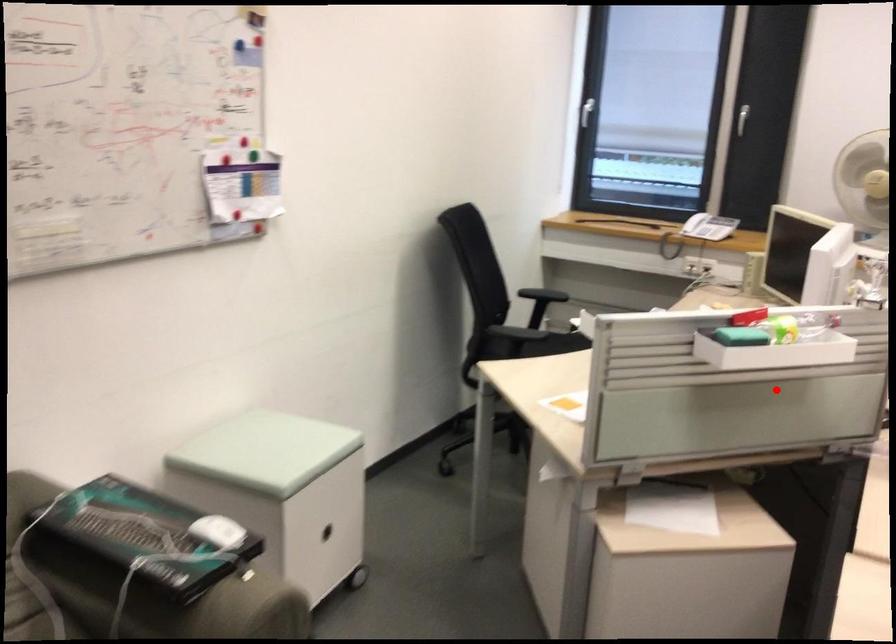
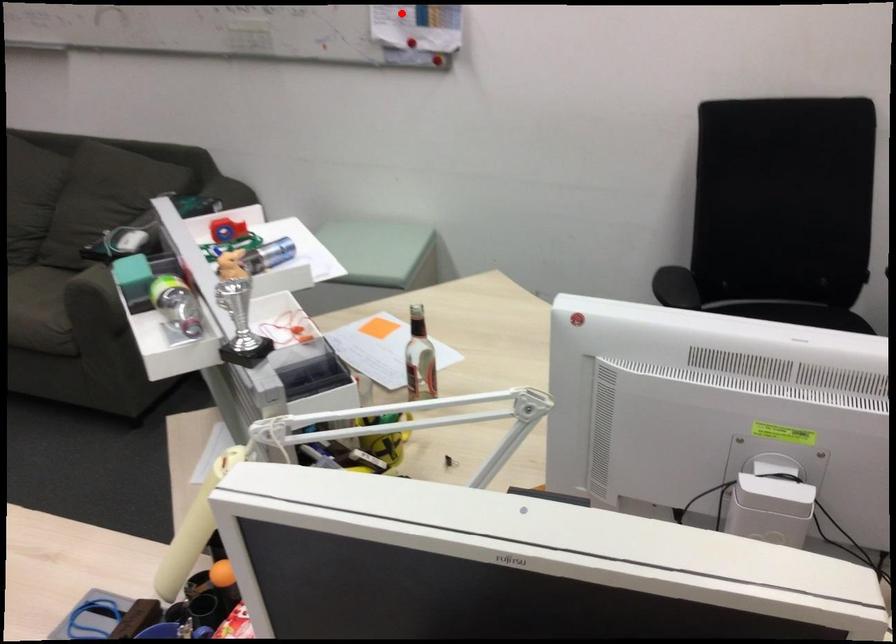
Based on the photo, I am providing you with two images of the same scene from different viewpoints. A red point is marked on the first image and another point is marked on the second image. Are the points marked in image1 and image2 representing the same 3D position?

No